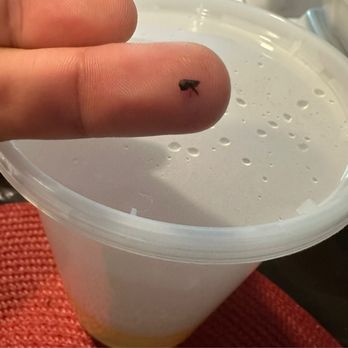
What are the coordinates of `dark colored table` in the screenshot? It's located at (317, 271).